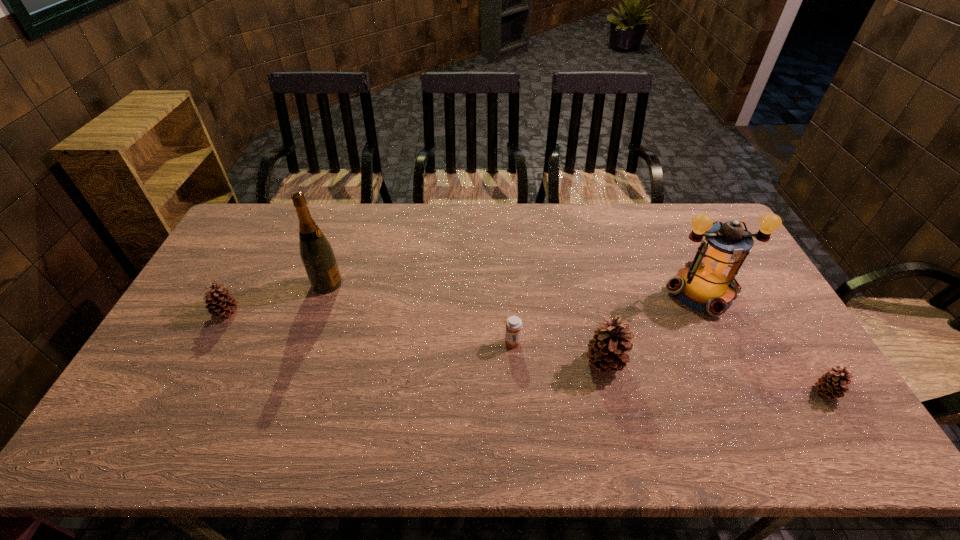
The height and width of the screenshot is (540, 960). I want to click on free space at the far edge of the desktop, so click(x=552, y=204).

Where is `free point at the near edge`? free point at the near edge is located at coordinates (206, 394).

You are a GUI agent. You are given a task and a screenshot of the screen. Output one action in this format:
    pyautogui.click(x=<x>, y=<y>)
    Task: Click on the vacant position at the left edge of the desktop
    
    Given the screenshot: What is the action you would take?
    pyautogui.click(x=227, y=330)

You are a GUI agent. You are given a task and a screenshot of the screen. Output one action in this format:
    pyautogui.click(x=<x>, y=<y>)
    Task: Click on the vacant space at the right edge of the desktop
    The width and height of the screenshot is (960, 540).
    Given the screenshot: What is the action you would take?
    pyautogui.click(x=753, y=358)

At what (x,y) coordinates should I click in order to perform the action: click on vacant space at the far left corner of the desktop. Please return your answer as a coordinate pair (x, y). The image size is (960, 540). Looking at the image, I should click on (250, 228).

Where is `vacant area between the third object from right to left and the second tallest object`? vacant area between the third object from right to left and the second tallest object is located at coordinates (654, 327).

Where is `free spot between the second object from left to right and the fifth object from left to right`? The width and height of the screenshot is (960, 540). free spot between the second object from left to right and the fifth object from left to right is located at coordinates (515, 288).

At what (x,y) coordinates should I click in order to perform the action: click on unoccupied position between the second nearest pinecone and the rightmost object. Please return your answer as a coordinate pair (x, y). Image resolution: width=960 pixels, height=540 pixels. Looking at the image, I should click on [715, 378].

Image resolution: width=960 pixels, height=540 pixels. In order to click on free space between the third object from left to right and the lantern in this screenshot , I will do `click(607, 317)`.

Locate an element on the screen. This screenshot has width=960, height=540. vacant area that lies between the wine bottle and the fourth object from right to left is located at coordinates (420, 313).